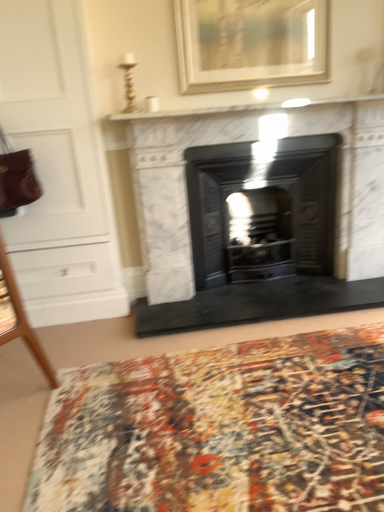
Question: Is gold/wooden picture frame at upper center to the right of multicolored woven mat at lower center from the viewer's perspective?

Choices:
 (A) no
 (B) yes

Answer: (B)

Question: Does gold/wooden picture frame at upper center turn towards multicolored woven mat at lower center?

Choices:
 (A) no
 (B) yes

Answer: (A)

Question: Does gold/wooden picture frame at upper center have a smaller size compared to multicolored woven mat at lower center?

Choices:
 (A) yes
 (B) no

Answer: (A)

Question: Considering the relative positions of gold/wooden picture frame at upper center and multicolored woven mat at lower center in the image provided, is gold/wooden picture frame at upper center in front of multicolored woven mat at lower center?

Choices:
 (A) no
 (B) yes

Answer: (A)

Question: Is gold/wooden picture frame at upper center to the left of multicolored woven mat at lower center from the viewer's perspective?

Choices:
 (A) yes
 (B) no

Answer: (B)

Question: Can you confirm if gold/wooden picture frame at upper center is thinner than multicolored woven mat at lower center?

Choices:
 (A) yes
 (B) no

Answer: (A)

Question: From the image's perspective, would you say white marble fireplace at center is positioned over gold/wooden picture frame at upper center?

Choices:
 (A) no
 (B) yes

Answer: (A)

Question: From the image's perspective, is white marble fireplace at center beneath gold/wooden picture frame at upper center?

Choices:
 (A) yes
 (B) no

Answer: (A)

Question: Is white marble fireplace at center oriented towards gold/wooden picture frame at upper center?

Choices:
 (A) yes
 (B) no

Answer: (B)

Question: Considering the relative sizes of white marble fireplace at center and gold/wooden picture frame at upper center in the image provided, is white marble fireplace at center thinner than gold/wooden picture frame at upper center?

Choices:
 (A) no
 (B) yes

Answer: (A)

Question: Would you say white marble fireplace at center is a long distance from gold/wooden picture frame at upper center?

Choices:
 (A) no
 (B) yes

Answer: (A)

Question: Can you confirm if white marble fireplace at center is taller than gold/wooden picture frame at upper center?

Choices:
 (A) no
 (B) yes

Answer: (B)

Question: Can you confirm if multicolored woven mat at lower center is shorter than matte black wood burning stove at center?

Choices:
 (A) yes
 (B) no

Answer: (A)